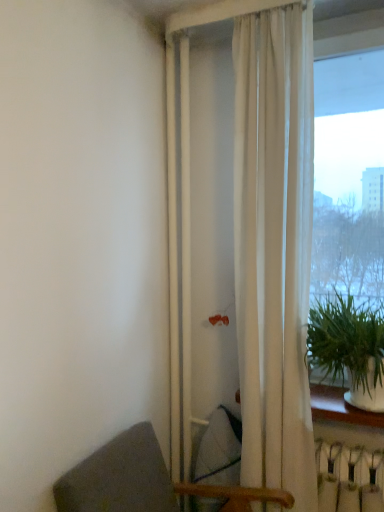
Question: In terms of size, does transparent glass window at right appear bigger or smaller than dark gray fabric chair at lower left?

Choices:
 (A) big
 (B) small

Answer: (B)

Question: Is transparent glass window at right taller or shorter than dark gray fabric chair at lower left?

Choices:
 (A) tall
 (B) short

Answer: (A)

Question: Estimate the real-world distances between objects in this image. Which object is farther from the white plastic radiator at lower right?

Choices:
 (A) transparent glass window at right
 (B) white sheer curtain at center
 (C) green leafy plant at right
 (D) dark gray fabric chair at lower left

Answer: (A)

Question: Estimate the real-world distances between objects in this image. Which object is farther from the transparent glass window at right?

Choices:
 (A) green leafy plant at right
 (B) white plastic radiator at lower right
 (C) dark gray fabric chair at lower left
 (D) white sheer curtain at center

Answer: (C)